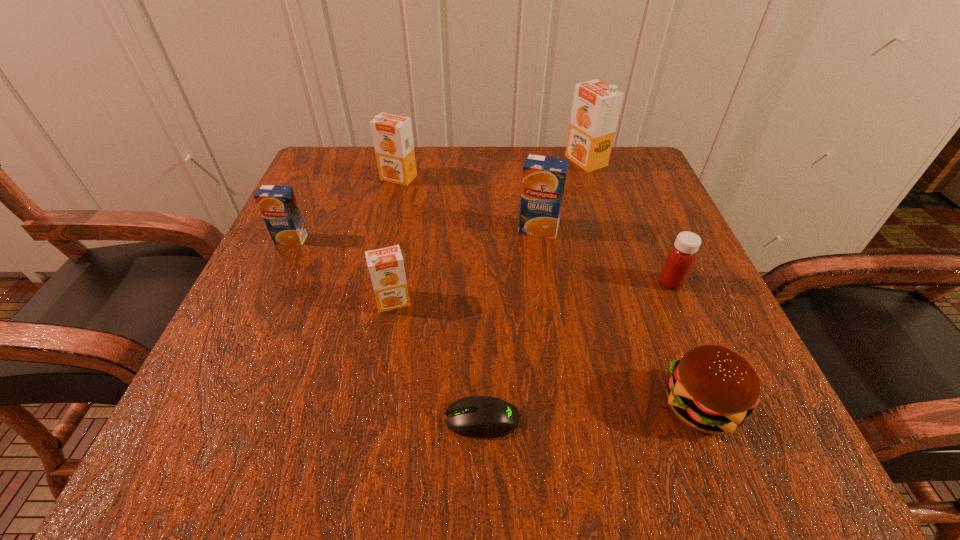
What are the coordinates of `the tallest orange juice` in the screenshot? It's located at (596, 106).

The width and height of the screenshot is (960, 540). In order to click on the tallest object in this screenshot , I will do `click(596, 106)`.

The image size is (960, 540). I want to click on the fourth orange juice from left to right, so click(x=543, y=182).

This screenshot has width=960, height=540. Identify the location of the bigger blue orange_juice. (543, 182).

The width and height of the screenshot is (960, 540). In order to click on the second smallest orange orange juice in this screenshot , I will do `click(392, 135)`.

The width and height of the screenshot is (960, 540). In order to click on the smaller blue orange_juice in this screenshot , I will do `click(278, 206)`.

You are a GUI agent. You are given a task and a screenshot of the screen. Output one action in this format:
    pyautogui.click(x=<x>, y=<y>)
    Task: Click on the leftmost orange juice
    This screenshot has height=540, width=960.
    Given the screenshot: What is the action you would take?
    pyautogui.click(x=278, y=206)

At what (x,y) coordinates should I click in order to perform the action: click on the nearest orange juice. Please return your answer as a coordinate pair (x, y). The image size is (960, 540). Looking at the image, I should click on (386, 266).

Find the location of `the smallest orange orange juice`. the smallest orange orange juice is located at coordinates [386, 266].

The height and width of the screenshot is (540, 960). I want to click on red medicine, so click(x=681, y=258).